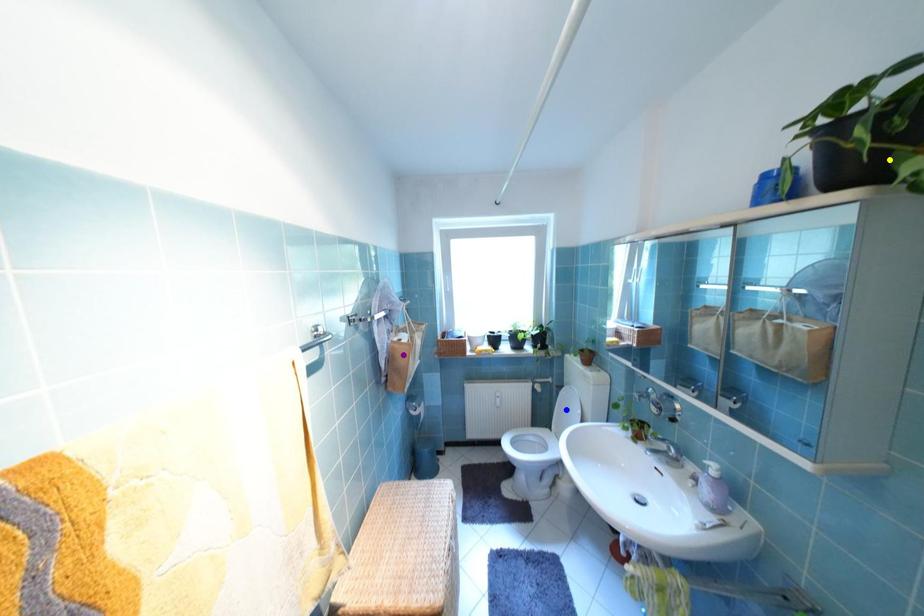
Order these from nearest to farthest:
1. blue point
2. yellow point
3. purple point

1. yellow point
2. purple point
3. blue point